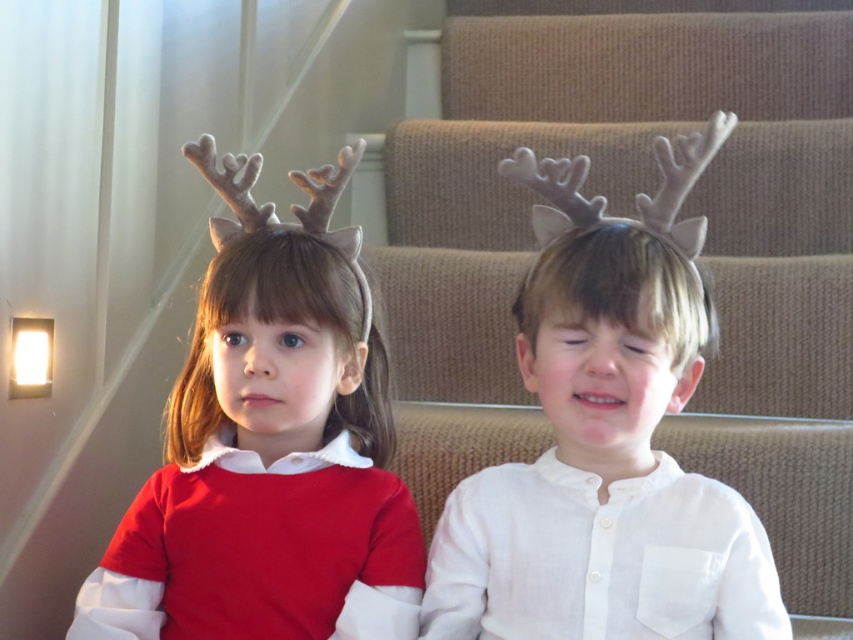
Who is shorter, matte red sweater at left or white matte antlers at center?

With less height is matte red sweater at left.

Identify the location of matte red sweater at left. The height and width of the screenshot is (640, 853). (270, 448).

Find the location of a particular element. Image resolution: width=853 pixels, height=640 pixels. matte red sweater at left is located at coordinates (270, 448).